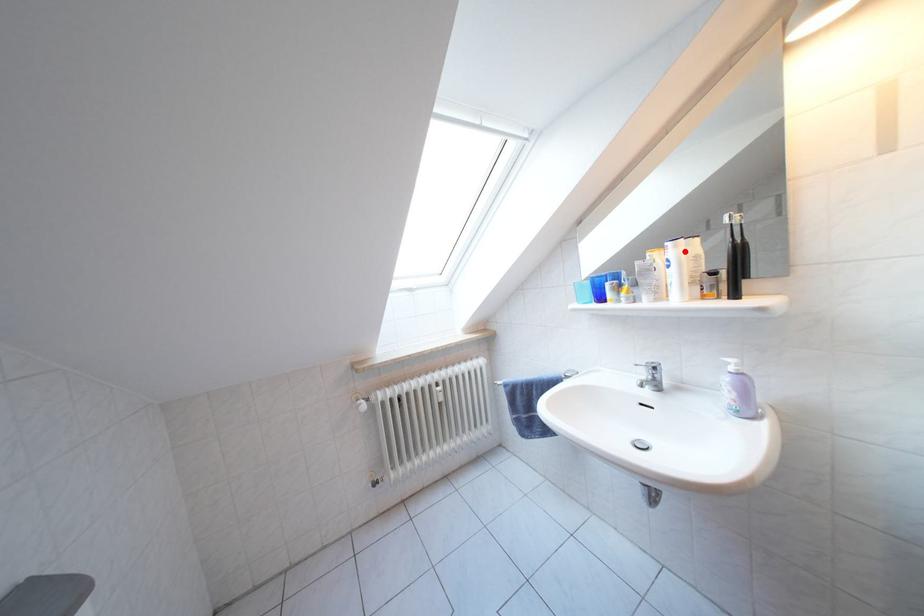
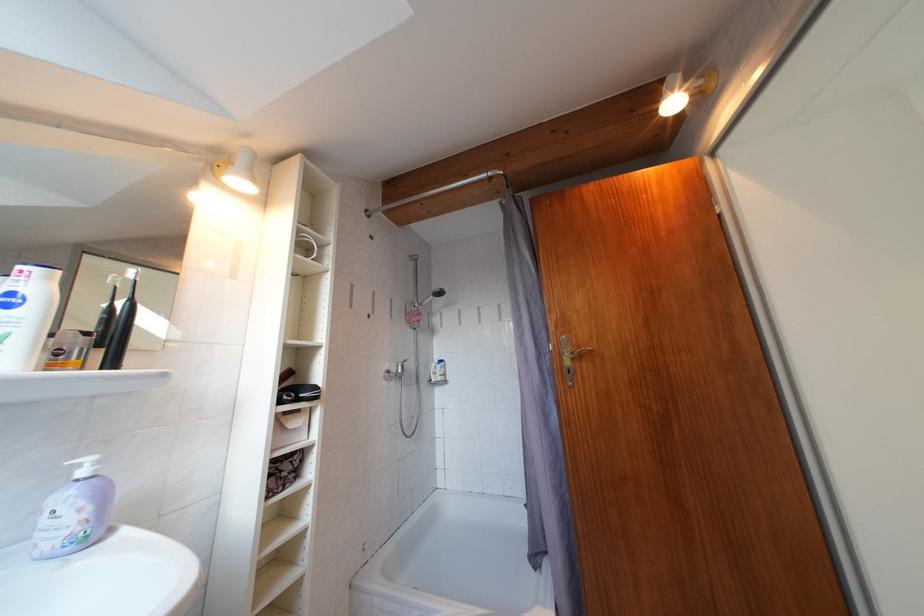
Locate, in the second image, the point that corresponds to the highlighted location in the first image.

(56, 283)